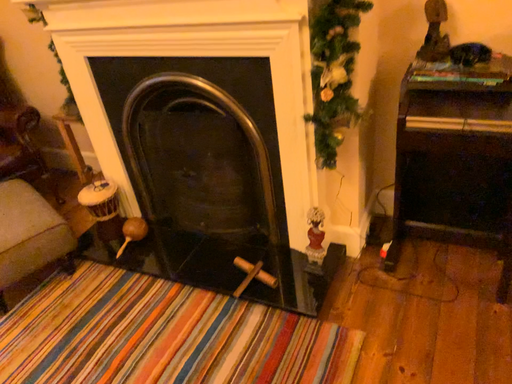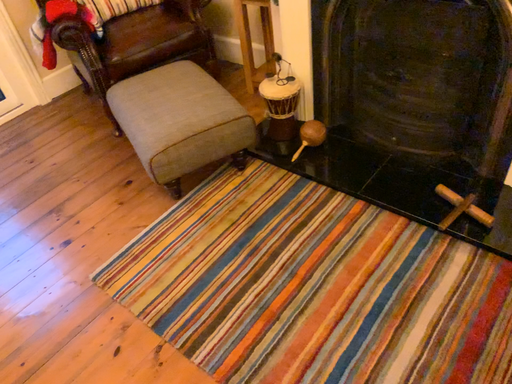
Question: How did the camera likely rotate when shooting the video?

Choices:
 (A) rotated right
 (B) rotated left

Answer: (B)